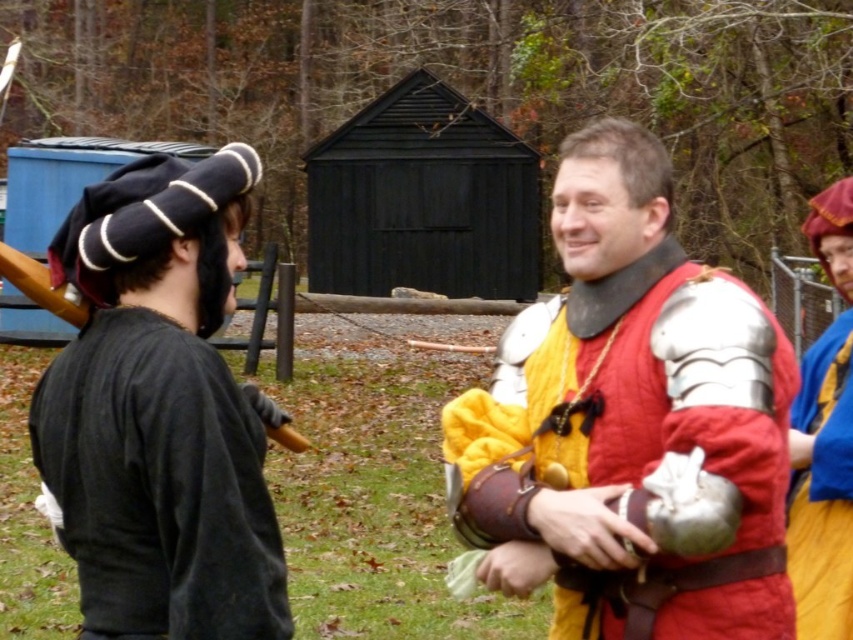
Based on the photo, you are an observer at the historical reenactment. You see the metallic armor at center and the velvet blue robe at right. Which one do you see first as you look from left to right across the scene?

The metallic armor at center is closer to the viewer than the velvet blue robe at right, so you would see the metallic armor at center first when looking from left to right.

You are a photographer trying to capture the scene with a camera positioned at the center. You notice two points marked in the image. Which point, point (x=164, y=296) or point (x=851, y=502), is closer to your camera?

Point (x=164, y=296) is closer to the camera than point (x=851, y=502).

You are an event organizer planning to place a decorative banner between the black velvet hat at left and the velvet blue robe at right. Since the banner needs to be wider than both items to cover them, which item determines the minimum width required for the banner?

The banner must be wider than the black velvet hat at left because its width is larger than that of the velvet blue robe at right.